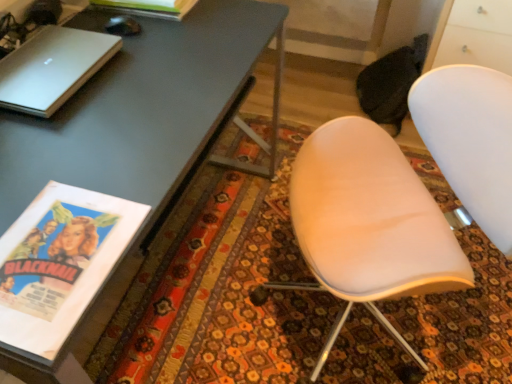
This screenshot has width=512, height=384. What are the coordinates of `vacant space that's between matte paper magazine at upper left and black glossy mouse at upper left` in the screenshot? It's located at (125, 22).